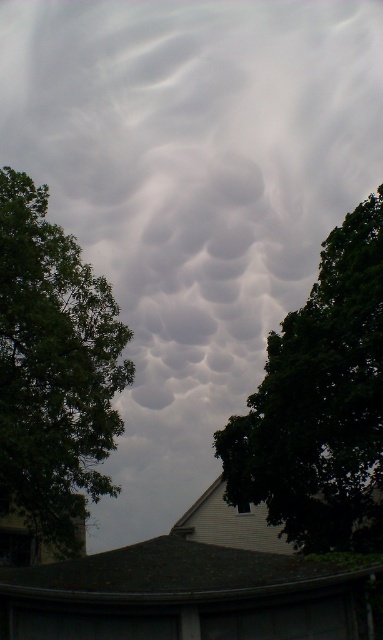
Question: Does green leafy tree at center appear under green leafy tree at left?

Choices:
 (A) no
 (B) yes

Answer: (B)

Question: From the image, what is the correct spatial relationship of green leafy tree at center in relation to green leafy tree at left?

Choices:
 (A) right
 (B) left

Answer: (A)

Question: Is green leafy tree at center wider than green leafy tree at left?

Choices:
 (A) no
 (B) yes

Answer: (A)

Question: Which of the following is the closest to the observer?

Choices:
 (A) (309, 476)
 (B) (101, 476)

Answer: (A)

Question: Which point is farther to the camera?

Choices:
 (A) green leafy tree at center
 (B) green leafy tree at left

Answer: (A)